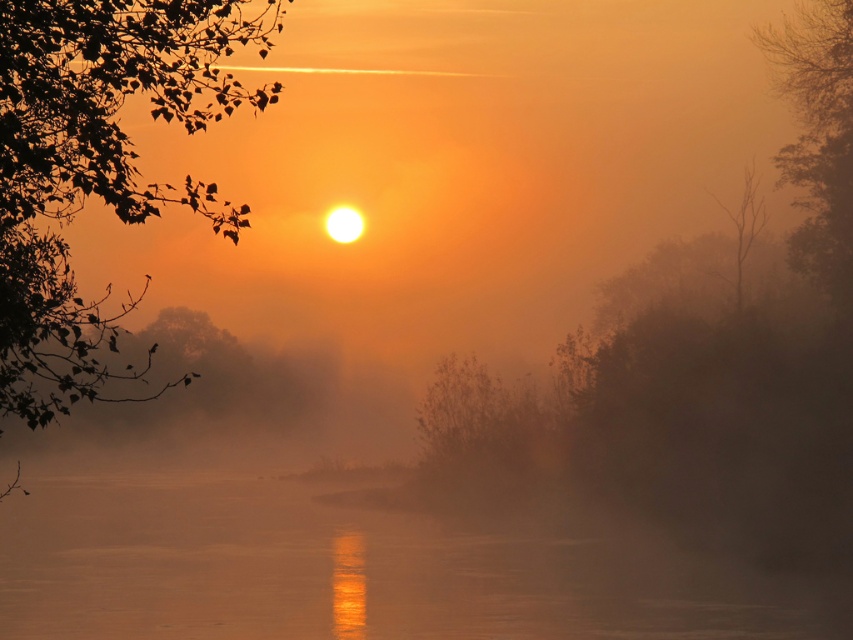
Does green leafy tree at upper left appear under green matte tree at upper right?

Incorrect, green leafy tree at upper left is not positioned below green matte tree at upper right.

Does green leafy tree at upper left appear over green matte tree at upper right?

Yes, green leafy tree at upper left is above green matte tree at upper right.

Find the location of a particular element. This screenshot has width=853, height=640. green leafy tree at upper left is located at coordinates (97, 164).

Identify the location of green leafy tree at upper left. (97, 164).

Can you confirm if smooth water at center is thinner than brown fuzzy bush at center?

No, smooth water at center is not thinner than brown fuzzy bush at center.

Who is lower down, smooth water at center or brown fuzzy bush at center?

smooth water at center is below.

Identify the location of smooth water at center. The height and width of the screenshot is (640, 853). (352, 572).

Who is more forward, (537, 547) or (805, 196)?

Point (537, 547) is more forward.

Is smooth water at center above green matte tree at upper right?

No.

Who is more forward, (363, 564) or (799, 120)?

Point (363, 564)

Where is `smooth water at center`? Image resolution: width=853 pixels, height=640 pixels. smooth water at center is located at coordinates (352, 572).